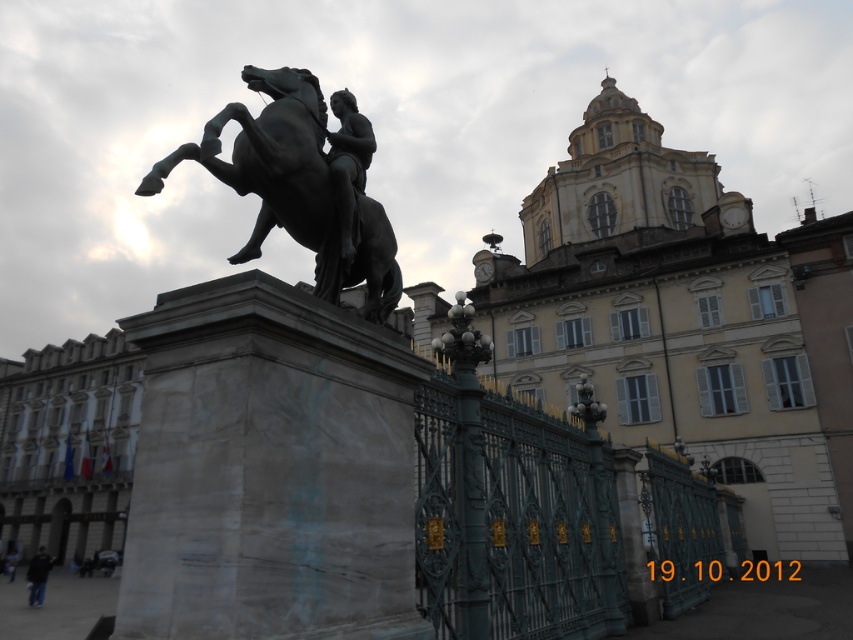
You are standing in the historical urban scene and want to approach the green wrought iron fence at center. If your walking speed is 3 feet per second, how many seconds will it take you to reach the fence?

The distance between the green wrought iron fence at center and the viewer is 49.60 feet. At a walking speed of 3 feet per second, it will take approximately 16.53 seconds to reach the fence. Since the question asks for the time in seconds, rounding to two decimal places gives 16.53 seconds.

You are a visitor standing in front of the grand building. You see the green wrought iron fence at center and the polished bronze statue at center. Which object is located to the right of the other?

The green wrought iron fence at center is positioned on the right side of the polished bronze statue at center.

You are standing in the historical urban scene and want to approach the green wrought iron fence at center. Based on the coordinates provided in the Objects Description, can you determine if the fence is closer to the equestrian statue or the grand building in the background?

The green wrought iron fence at center is located at point (514, 515). Since the coordinates are closer to the center of the image, it is likely positioned between the equestrian statue and the grand building, but without additional coordinate data for the other objects, we cannot definitively determine its proximity to either. However, based on typical compositional layouts, the fence might be near the foreground or midground, possibly closer to the statue if the building is in the background.